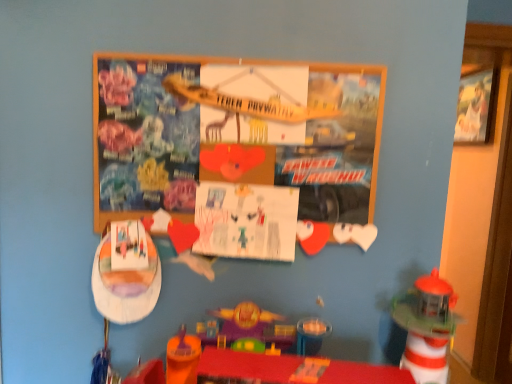
What is the approximate width of translucent plastic lighthouse at lower right, placed as the 1th toy when sorted from right to left?

translucent plastic lighthouse at lower right, placed as the 1th toy when sorted from right to left, is 6.61 inches in width.

The width and height of the screenshot is (512, 384). Find the location of `wooden bulletin board at center`. wooden bulletin board at center is located at coordinates (234, 133).

Describe the element at coordinates (125, 285) in the screenshot. This screenshot has width=512, height=384. I see `wooden boat at lower left, the first toy when ordered from left to right` at that location.

What do you see at coordinates (246, 221) in the screenshot?
I see `white paper at center` at bounding box center [246, 221].

What do you see at coordinates (475, 107) in the screenshot? The image size is (512, 384). I see `wooden picture frame at upper right` at bounding box center [475, 107].

Where is `translucent plastic lighthouse at lower right, the 2th toy positioned from the left`? translucent plastic lighthouse at lower right, the 2th toy positioned from the left is located at coordinates (426, 327).

From the picture: Is wooden picture frame at upper right far away from wooden boat at lower left, the first toy when ordered from left to right?

Yes, wooden picture frame at upper right is far from wooden boat at lower left, the first toy when ordered from left to right.

Is wooden picture frame at upper right spatially inside wooden boat at lower left, the 2th toy from the right, or outside of it?

wooden picture frame at upper right exists outside the volume of wooden boat at lower left, the 2th toy from the right.

Is point (487, 77) closer or farther from the camera than point (99, 282)?

Point (487, 77) is farther from the camera than point (99, 282).

Can you tell me how much wooden picture frame at upper right and wooden boat at lower left, the first toy when ordered from left to right, differ in facing direction?

wooden picture frame at upper right and wooden boat at lower left, the first toy when ordered from left to right, are facing 89.2 degrees away from each other.

Which is closer to the camera, (131, 107) or (470, 83)?

Point (131, 107) is positioned closer to the camera compared to point (470, 83).

In the scene shown: Based on their positions, is wooden bulletin board at center located to the left or right of wooden picture frame at upper right?

From the image, it's evident that wooden bulletin board at center is to the left of wooden picture frame at upper right.

Does wooden bulletin board at center have a lesser height compared to wooden picture frame at upper right?

Indeed, wooden bulletin board at center has a lesser height compared to wooden picture frame at upper right.

Is wooden bulletin board at center shorter than wooden boat at lower left, the first toy when ordered from left to right?

In fact, wooden bulletin board at center may be taller than wooden boat at lower left, the first toy when ordered from left to right.

Does wooden bulletin board at center have a larger size compared to wooden boat at lower left, the first toy when ordered from left to right?

Yes.

Looking at their sizes, would you say wooden bulletin board at center is wider or thinner than wooden boat at lower left, the first toy when ordered from left to right?

Clearly, wooden bulletin board at center has less width compared to wooden boat at lower left, the first toy when ordered from left to right.

Identify the location of bulletin board above the wooden boat at lower left, the first toy when ordered from left to right (from a real-world perspective). (234, 133).

In the scene shown: Which is more to the right, wooden bulletin board at center or white paper at center?

Positioned to the right is white paper at center.

Which object is wider, wooden bulletin board at center or white paper at center?

wooden bulletin board at center.

Are wooden bulletin board at center and white paper at center far apart?

No, wooden bulletin board at center is in close proximity to white paper at center.

Which object is further away from the camera taking this photo, wooden bulletin board at center or white paper at center?

white paper at center is behind.

Does wooden boat at lower left, the first toy when ordered from left to right, have a lesser width compared to wooden picture frame at upper right?

Correct, the width of wooden boat at lower left, the first toy when ordered from left to right, is less than that of wooden picture frame at upper right.

Is wooden picture frame at upper right at the back of wooden boat at lower left, the 2th toy from the right?

No, wooden picture frame at upper right is not at the back of wooden boat at lower left, the 2th toy from the right.

Considering the sizes of objects wooden boat at lower left, the first toy when ordered from left to right, and wooden picture frame at upper right in the image provided, who is bigger, wooden boat at lower left, the first toy when ordered from left to right, or wooden picture frame at upper right?

wooden picture frame at upper right is bigger.

Between wooden boat at lower left, the 2th toy from the right, and wooden picture frame at upper right, which one has more height?

wooden picture frame at upper right is taller.

Considering the sizes of objects translucent plastic lighthouse at lower right, the 2th toy positioned from the left, and wooden bulletin board at center in the image provided, who is taller, translucent plastic lighthouse at lower right, the 2th toy positioned from the left, or wooden bulletin board at center?

Standing taller between the two is wooden bulletin board at center.

Is translucent plastic lighthouse at lower right, the 2th toy positioned from the left, turned away from wooden bulletin board at center?

No, translucent plastic lighthouse at lower right, the 2th toy positioned from the left, is not facing the opposite direction of wooden bulletin board at center.

From a real-world perspective, is translucent plastic lighthouse at lower right, placed as the 1th toy when sorted from right to left, physically below wooden bulletin board at center?

Yes, from a real-world perspective, translucent plastic lighthouse at lower right, placed as the 1th toy when sorted from right to left, is below wooden bulletin board at center.

Can we say translucent plastic lighthouse at lower right, placed as the 1th toy when sorted from right to left, lies outside wooden bulletin board at center?

Indeed, translucent plastic lighthouse at lower right, placed as the 1th toy when sorted from right to left, is completely outside wooden bulletin board at center.

Does wooden picture frame at upper right contain wooden bulletin board at center?

No, wooden picture frame at upper right does not contain wooden bulletin board at center.

How many degrees apart are the facing directions of wooden picture frame at upper right and wooden bulletin board at center?

They differ by 89.2 degrees in their facing directions.

Which is less distant, (x=468, y=138) or (x=126, y=167)?

Point (x=468, y=138).

Considering the sizes of objects wooden picture frame at upper right and wooden bulletin board at center in the image provided, who is shorter, wooden picture frame at upper right or wooden bulletin board at center?

Standing shorter between the two is wooden bulletin board at center.

Where is `picture frame behind the wooden boat at lower left, the 2th toy from the right`? The width and height of the screenshot is (512, 384). picture frame behind the wooden boat at lower left, the 2th toy from the right is located at coordinates (475, 107).

You are a GUI agent. You are given a task and a screenshot of the screen. Output one action in this format:
    pyautogui.click(x=<x>, y=<y>)
    Task: Click on the bulletin board below the wooden picture frame at upper right (from the image's perspective)
    
    Given the screenshot: What is the action you would take?
    pyautogui.click(x=234, y=133)

Looking at the image, which one is located closer to wooden bulletin board at center, wooden picture frame at upper right or white paper at center?

Based on the image, white paper at center appears to be nearer to wooden bulletin board at center.

Based on their spatial positions, is translucent plastic lighthouse at lower right, the 2th toy positioned from the left, or wooden bulletin board at center further from wooden boat at lower left, the first toy when ordered from left to right?

translucent plastic lighthouse at lower right, the 2th toy positioned from the left, is positioned further to the anchor wooden boat at lower left, the first toy when ordered from left to right.

When comparing their distances from wooden boat at lower left, the first toy when ordered from left to right, does white paper at center or wooden picture frame at upper right seem further?

The object further to wooden boat at lower left, the first toy when ordered from left to right, is wooden picture frame at upper right.

Looking at this image, estimate the real-world distances between objects in this image. Which object is closer to white paper at center, wooden bulletin board at center or wooden picture frame at upper right?

wooden bulletin board at center is positioned closer to the anchor white paper at center.

Considering their positions, is white paper at center positioned closer to wooden bulletin board at center than wooden boat at lower left, the 2th toy from the right?

The object closer to wooden bulletin board at center is white paper at center.

From the image, which object appears to be farther from translucent plastic lighthouse at lower right, placed as the 1th toy when sorted from right to left, wooden picture frame at upper right or wooden bulletin board at center?

wooden picture frame at upper right is further to translucent plastic lighthouse at lower right, placed as the 1th toy when sorted from right to left.

Based on their spatial positions, is translucent plastic lighthouse at lower right, placed as the 1th toy when sorted from right to left, or wooden boat at lower left, the first toy when ordered from left to right, closer to wooden bulletin board at center?

wooden boat at lower left, the first toy when ordered from left to right, is closer to wooden bulletin board at center.

When comparing their distances from wooden boat at lower left, the 2th toy from the right, does white paper at center or wooden bulletin board at center seem further?

wooden bulletin board at center lies further to wooden boat at lower left, the 2th toy from the right, than the other object.

Find the location of a particular element. The width and height of the screenshot is (512, 384). bulletin board positioned between translucent plastic lighthouse at lower right, placed as the 1th toy when sorted from right to left, and wooden picture frame at upper right from near to far is located at coordinates (234, 133).

Locate an element on the screen. The height and width of the screenshot is (384, 512). poster page between translucent plastic lighthouse at lower right, placed as the 1th toy when sorted from right to left, and wooden picture frame at upper right from front to back is located at coordinates (246, 221).

I want to click on poster page located between wooden bulletin board at center and translucent plastic lighthouse at lower right, placed as the 1th toy when sorted from right to left, in the left-right direction, so click(x=246, y=221).

Find the location of `bulletin board between wooden boat at lower left, the first toy when ordered from left to right, and translucent plastic lighthouse at lower right, the 2th toy positioned from the left, from left to right`. bulletin board between wooden boat at lower left, the first toy when ordered from left to right, and translucent plastic lighthouse at lower right, the 2th toy positioned from the left, from left to right is located at coordinates (234, 133).